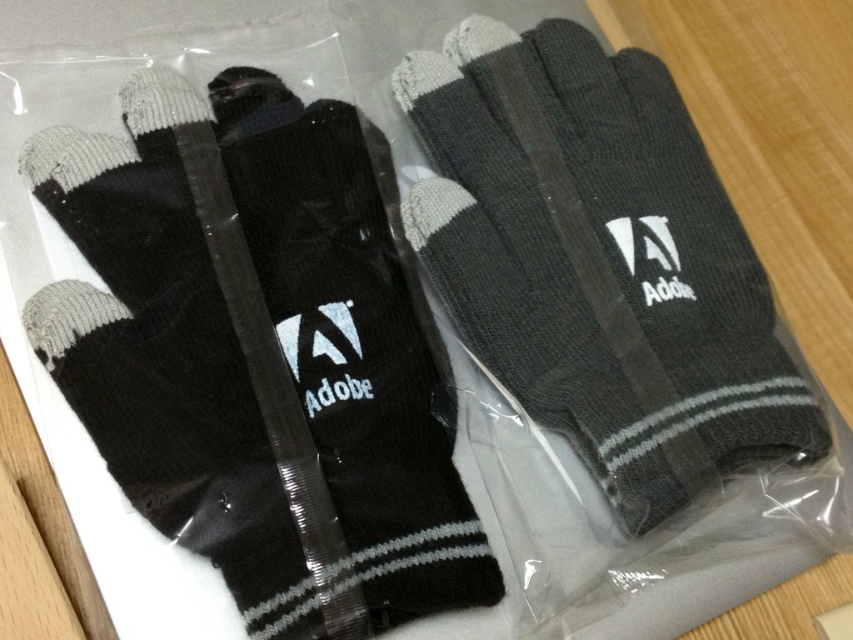
Question: Can you confirm if black knitted gloves at center is bigger than dark gray knitted glove at center?

Choices:
 (A) yes
 (B) no

Answer: (A)

Question: Can you confirm if black knitted gloves at center is positioned below dark gray knitted glove at center?

Choices:
 (A) yes
 (B) no

Answer: (A)

Question: Which point is closer to the camera taking this photo?

Choices:
 (A) (665, 516)
 (B) (239, 563)

Answer: (B)

Question: Does black knitted gloves at center appear on the right side of dark gray knitted glove at center?

Choices:
 (A) no
 (B) yes

Answer: (A)